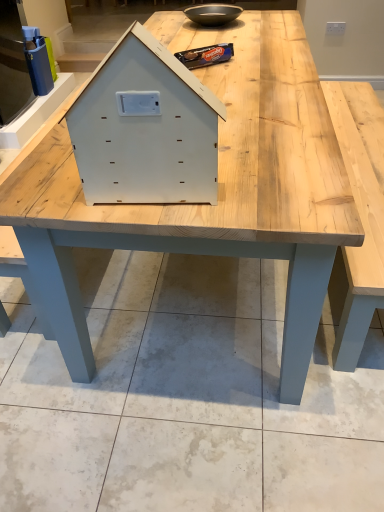
In order to click on vacant space situated on the left part of white matte wooden house at center in this screenshot , I will do `click(64, 192)`.